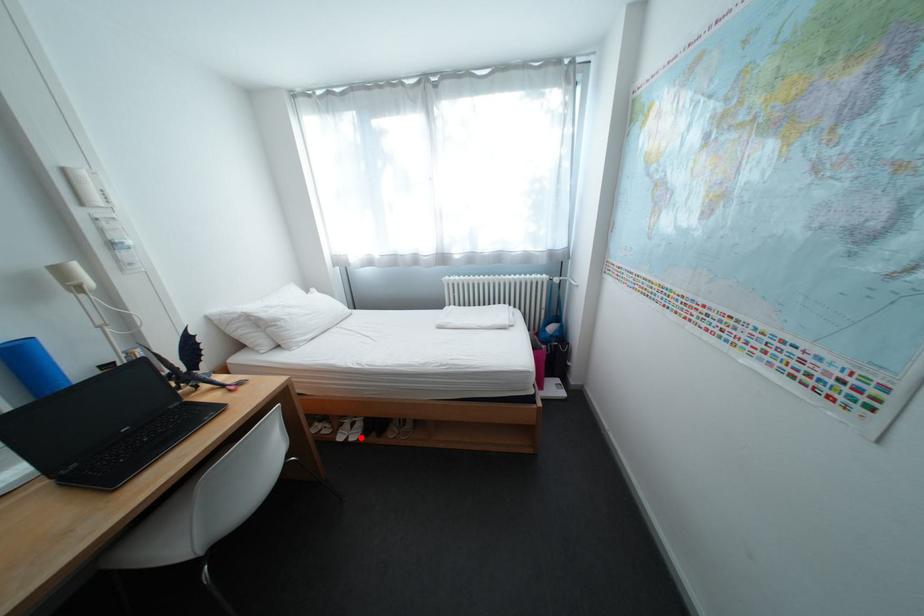
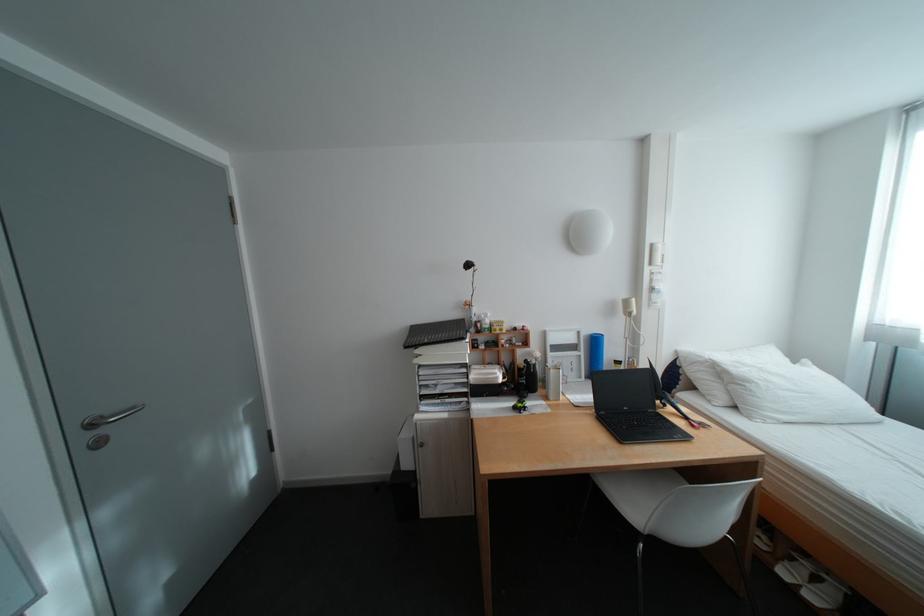
Where in the second image is the point corresponding to the highlighted location from the first image?

(813, 586)